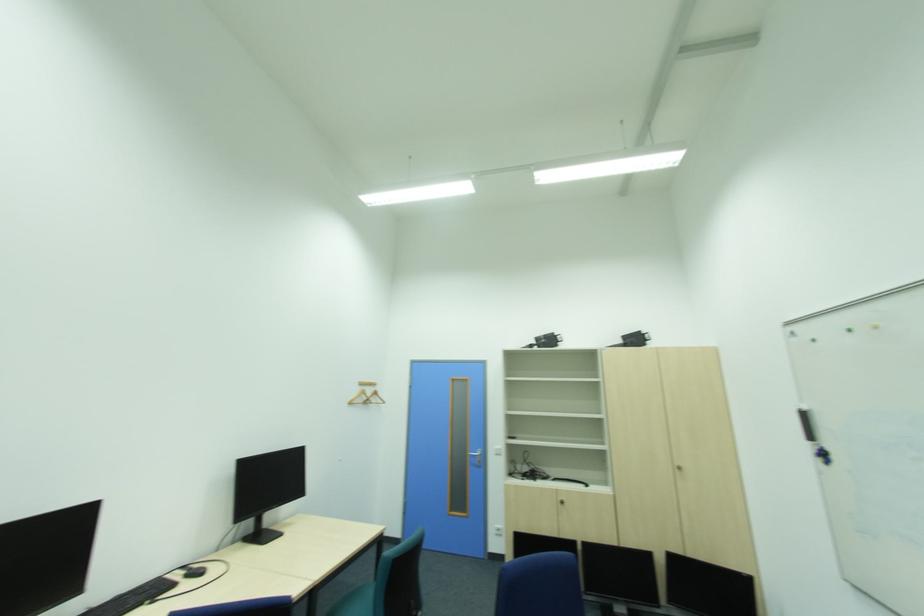
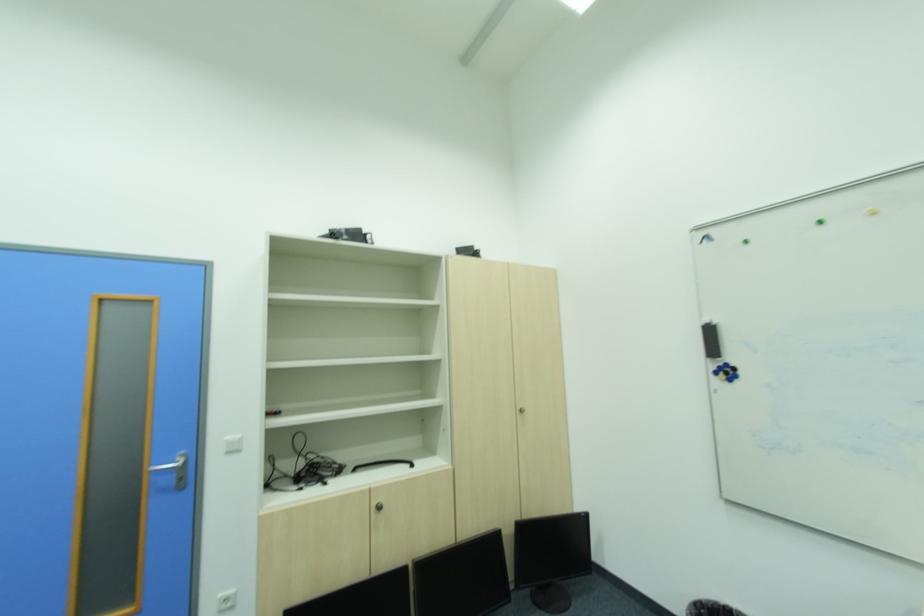
The point at (460, 381) is marked in the first image. Where is the corresponding point in the second image?

(111, 300)